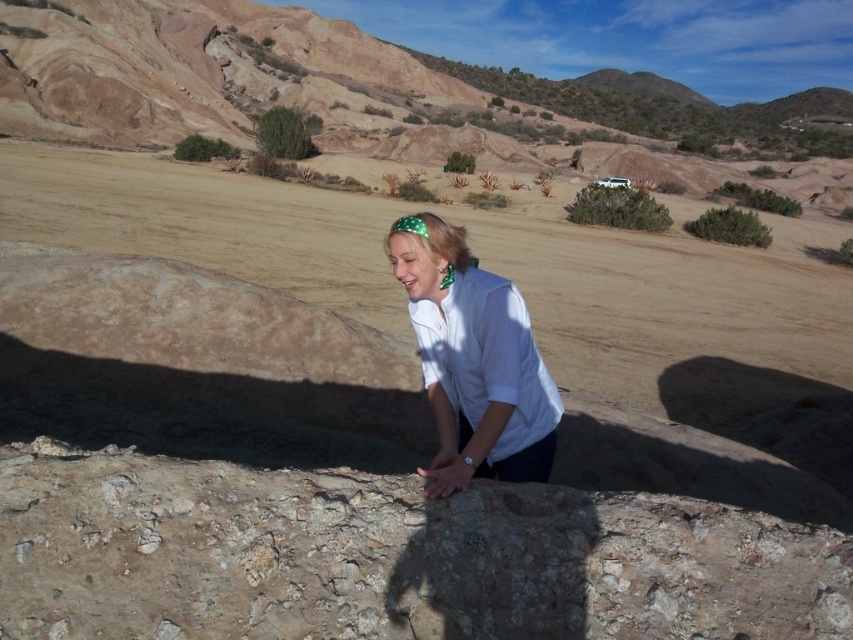
Who is more forward, (329, 221) or (497, 310)?

Positioned in front is point (497, 310).

Who is more distant from viewer, (x=114, y=177) or (x=440, y=476)?

The point (x=114, y=177) is more distant.

Image resolution: width=853 pixels, height=640 pixels. What do you see at coordinates (485, 268) in the screenshot?
I see `brown sandy dirt field at center` at bounding box center [485, 268].

Identify the location of brown sandy dirt field at center. The image size is (853, 640). (485, 268).